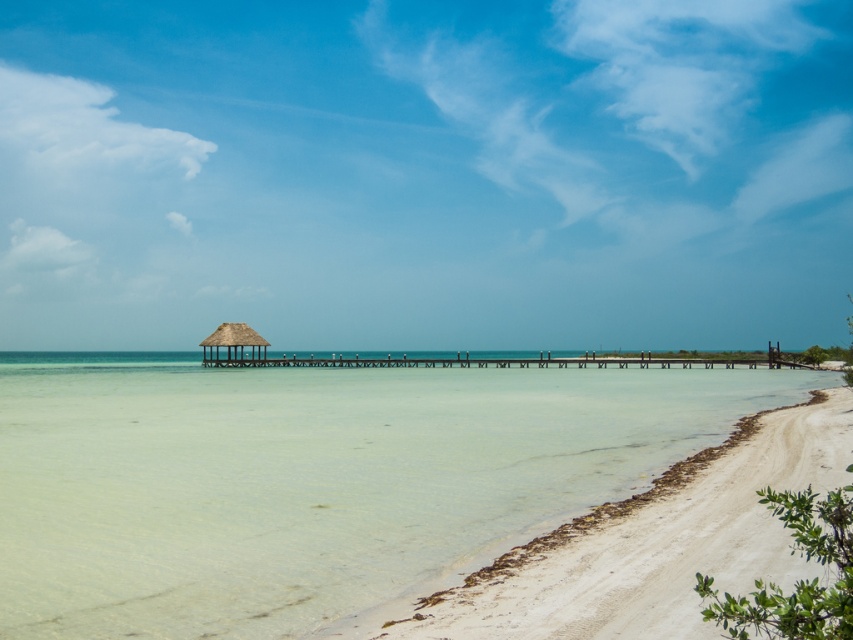
You are standing at the origin point of the image. Which direction should you move to reach the white sand beach at center?

The white sand beach at center is located at coordinates point (x=309, y=477), so you should move towards the right and slightly downward from your current position to reach it.

You are standing on the white sand beach at center and want to reach the thatched straw hut at center. Which direction should you move to get there?

The white sand beach at center is in front of the thatched straw hut at center, so you should move forward towards the thatched straw hut at center to reach it.